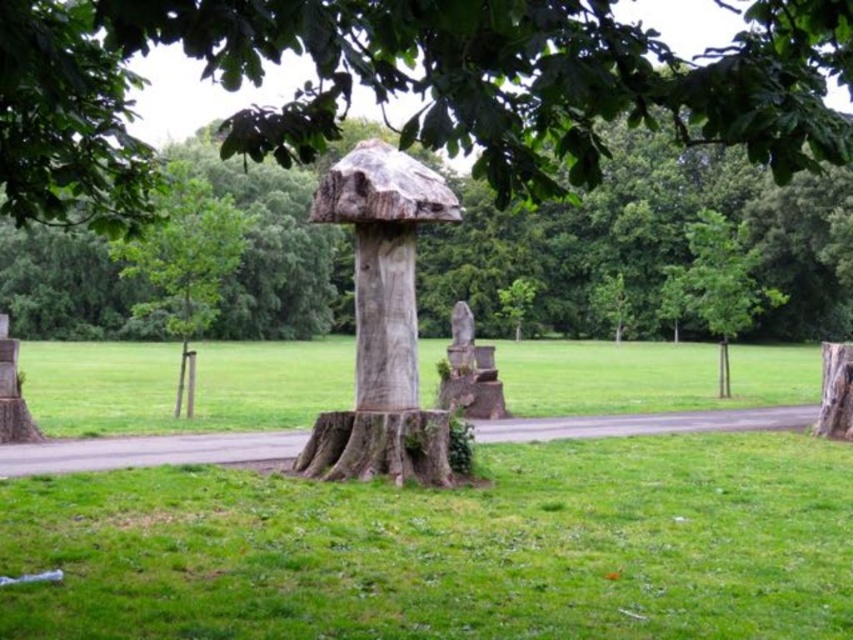
Question: Among these objects, which one is nearest to the camera?

Choices:
 (A) smooth brown tree stump at center
 (B) smooth stone statue at center

Answer: (A)

Question: Which point is closer to the camera?

Choices:
 (A) (236, 72)
 (B) (482, 396)
 (C) (440, 412)
 (D) (454, 362)

Answer: (A)

Question: Is wooden sculpture at center to the right of green wood tree at center from the viewer's perspective?

Choices:
 (A) yes
 (B) no

Answer: (A)

Question: Observing the image, what is the correct spatial positioning of smooth brown tree stump at center in reference to smooth stone statue at center?

Choices:
 (A) above
 (B) below

Answer: (B)

Question: Which point is farther from the camera taking this photo?

Choices:
 (A) (132, 308)
 (B) (408, 276)

Answer: (A)

Question: Does green leafy tree at center have a greater width compared to smooth stone statue at center?

Choices:
 (A) no
 (B) yes

Answer: (B)